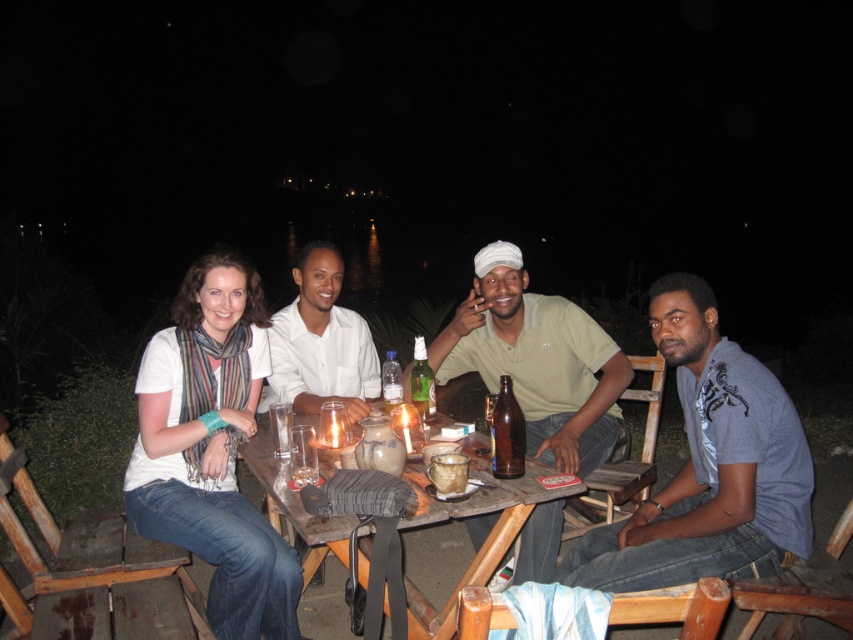
Is wooden table at center to the left of white matte shirt at center from the viewer's perspective?

Incorrect, wooden table at center is not on the left side of white matte shirt at center.

Between wooden table at center and white matte shirt at center, which one appears on the right side from the viewer's perspective?

From the viewer's perspective, wooden table at center appears more on the right side.

Between point (466, 516) and point (303, 349), which one is positioned behind?

The point (303, 349) is behind.

Where is `wooden table at center`? This screenshot has height=640, width=853. wooden table at center is located at coordinates (480, 541).

Is point (740, 448) in front of point (419, 634)?

Yes.

Which is behind, point (697, 433) or point (291, 499)?

The point (697, 433) is more distant.

What are the coordinates of `gray cotton t-shirt at lower right` in the screenshot? It's located at (709, 467).

Is gray cotton t-shirt at lower right thinner than brown glass bottle at center?

No, gray cotton t-shirt at lower right is not thinner than brown glass bottle at center.

At what (x,y) coordinates should I click in order to perform the action: click on gray cotton t-shirt at lower right. Please return your answer as a coordinate pair (x, y). This screenshot has width=853, height=640. Looking at the image, I should click on (709, 467).